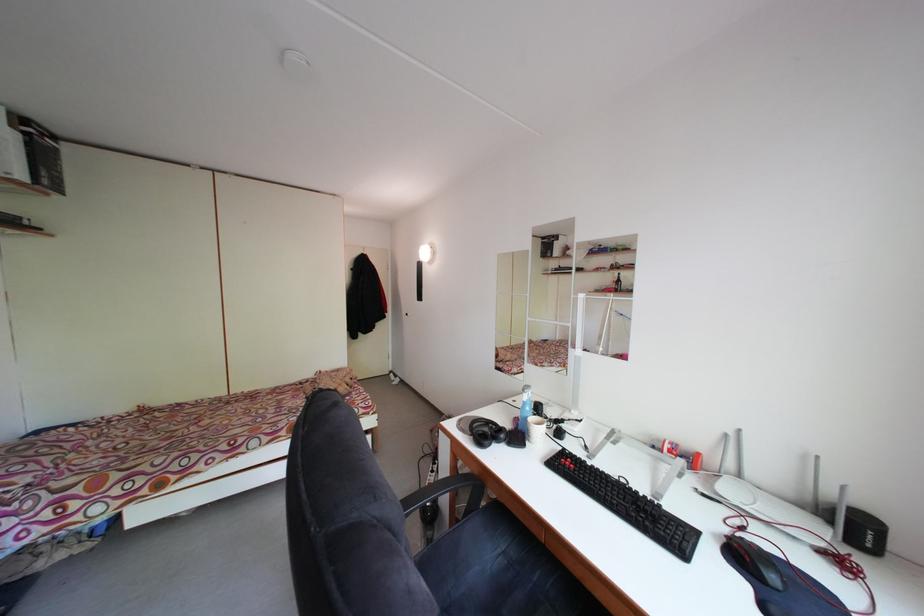
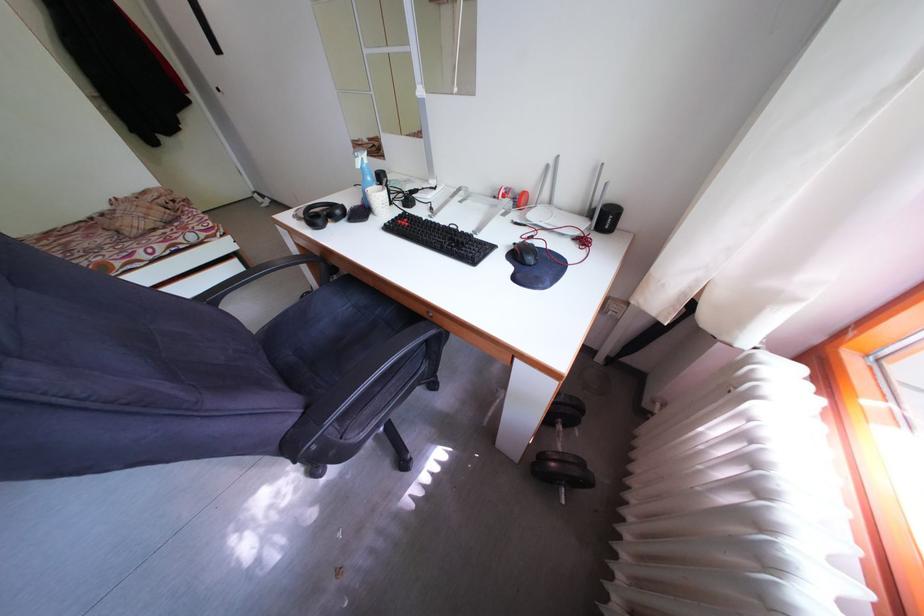
In the second image, find the point that corresponds to point 488,440 in the first image.

(321, 223)